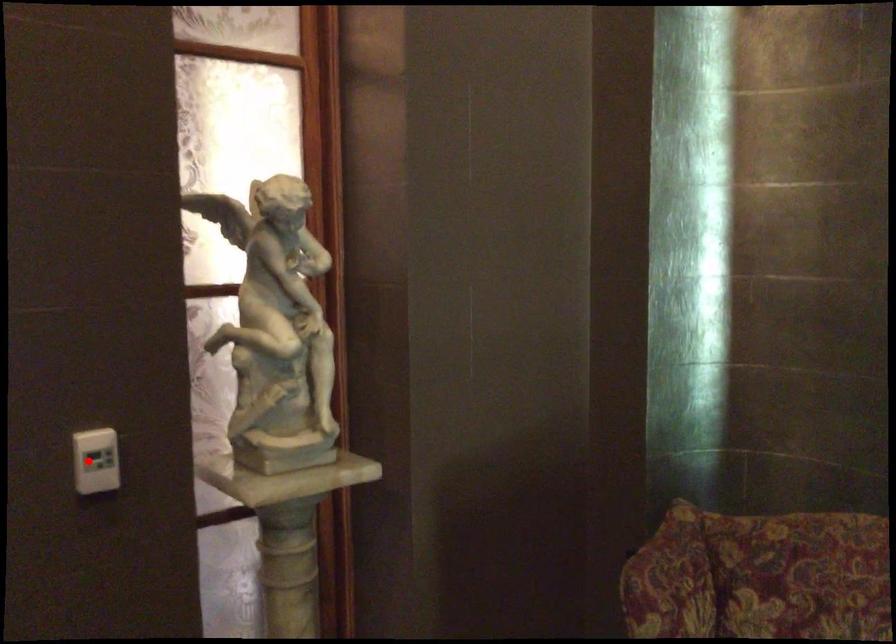
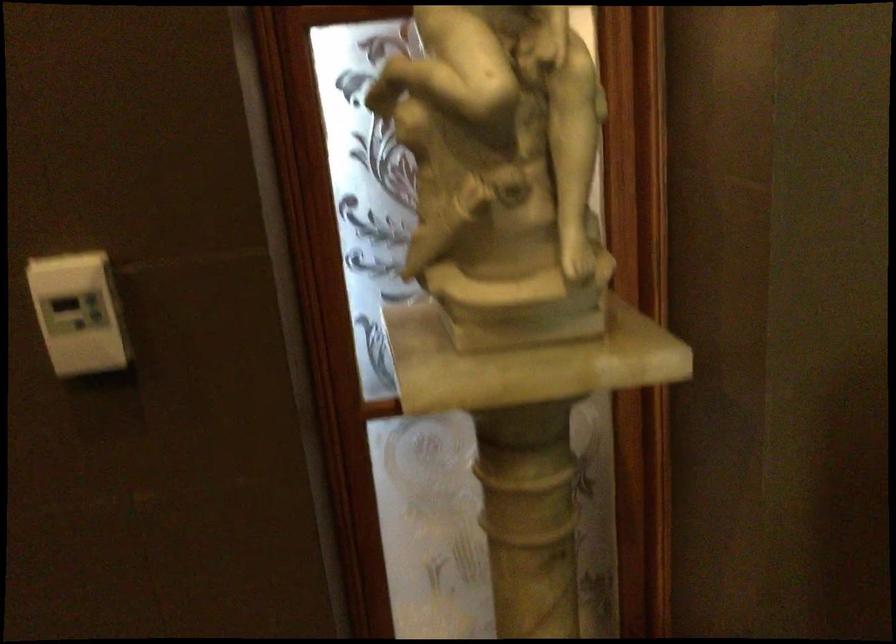
The point at the highlighted location is marked in the first image. Where is the corresponding point in the second image?

(79, 313)